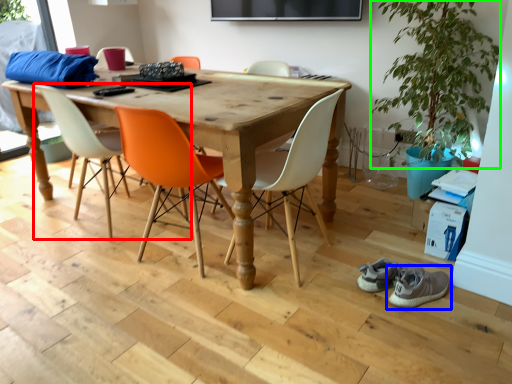
Question: Estimate the real-world distances between objects in this image. Which object is farther from chair (highlighted by a red box), footwear (highlighted by a blue box) or plant (highlighted by a green box)?

Choices:
 (A) footwear
 (B) plant

Answer: (B)